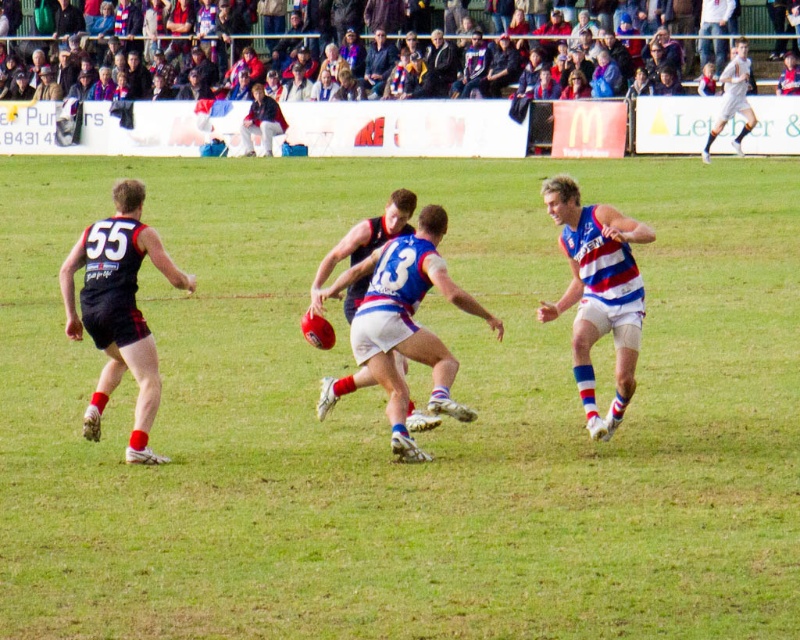
Between dark blue jersey at left and multicolored fabric seats at upper center, which one is positioned lower?

dark blue jersey at left is lower down.

Who is positioned more to the left, dark blue jersey at left or multicolored fabric seats at upper center?

multicolored fabric seats at upper center

This screenshot has width=800, height=640. In order to click on dark blue jersey at left in this screenshot , I will do `click(118, 310)`.

Which is in front, point (542, 316) or point (377, 36)?

Point (542, 316) is in front.

This screenshot has width=800, height=640. Describe the element at coordinates (598, 292) in the screenshot. I see `blue and white striped jersey at right` at that location.

Locate an element on the screen. blue and white striped jersey at right is located at coordinates (598, 292).

Can you confirm if blue and white jersey at center is smaller than dark blue suit at center?

Yes.

Is blue and white jersey at center bigger than dark blue suit at center?

Incorrect, blue and white jersey at center is not larger than dark blue suit at center.

This screenshot has height=640, width=800. What do you see at coordinates (368, 236) in the screenshot? I see `blue and white jersey at center` at bounding box center [368, 236].

Locate an element on the screen. blue and white jersey at center is located at coordinates (368, 236).